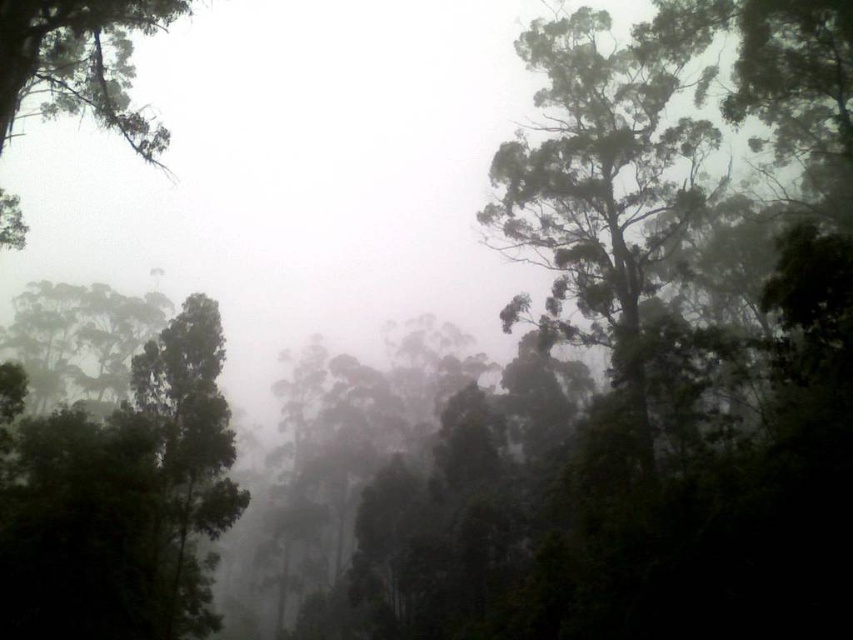
Does green leafy tree at upper right have a greater width compared to green matte tree at upper left?

In fact, green leafy tree at upper right might be narrower than green matte tree at upper left.

Find the location of a particular element. Image resolution: width=853 pixels, height=640 pixels. green leafy tree at upper right is located at coordinates tap(601, 182).

This screenshot has width=853, height=640. Find the location of `green leafy tree at upper right`. green leafy tree at upper right is located at coordinates (601, 182).

What are the coordinates of `green leafy tree at upper right` in the screenshot? It's located at (601, 182).

Does green matte tree at left have a greater height compared to green matte tree at upper left?

No.

Between green matte tree at left and green matte tree at upper left, which one has more height?

green matte tree at upper left

The height and width of the screenshot is (640, 853). Identify the location of green matte tree at left. (190, 452).

Does green leafy tree at upper right appear on the right side of green matte tree at left?

Indeed, green leafy tree at upper right is positioned on the right side of green matte tree at left.

Between point (569, 81) and point (160, 404), which one is positioned behind?

The point (569, 81) is behind.

I want to click on green leafy tree at upper right, so click(601, 182).

Where is `green leafy tree at upper right`? green leafy tree at upper right is located at coordinates (601, 182).